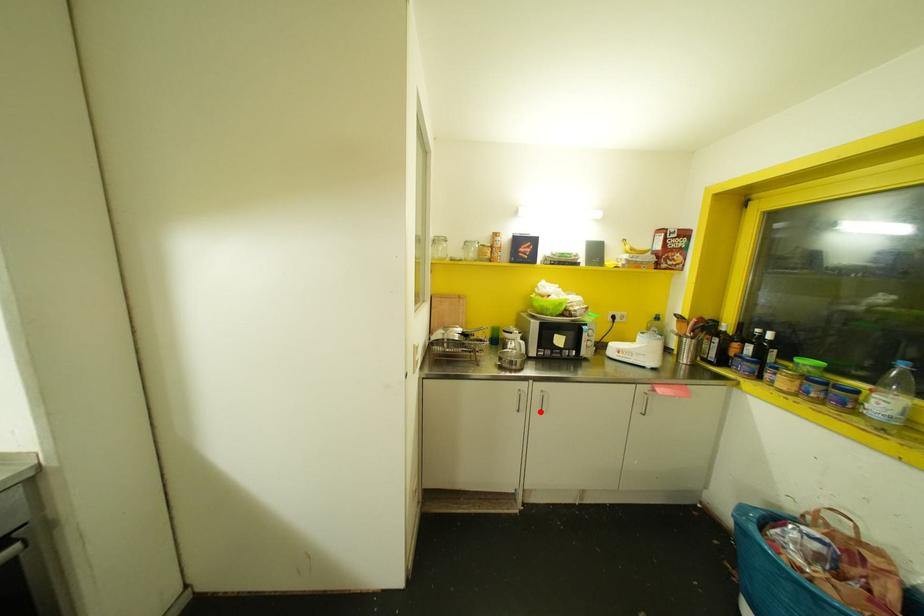
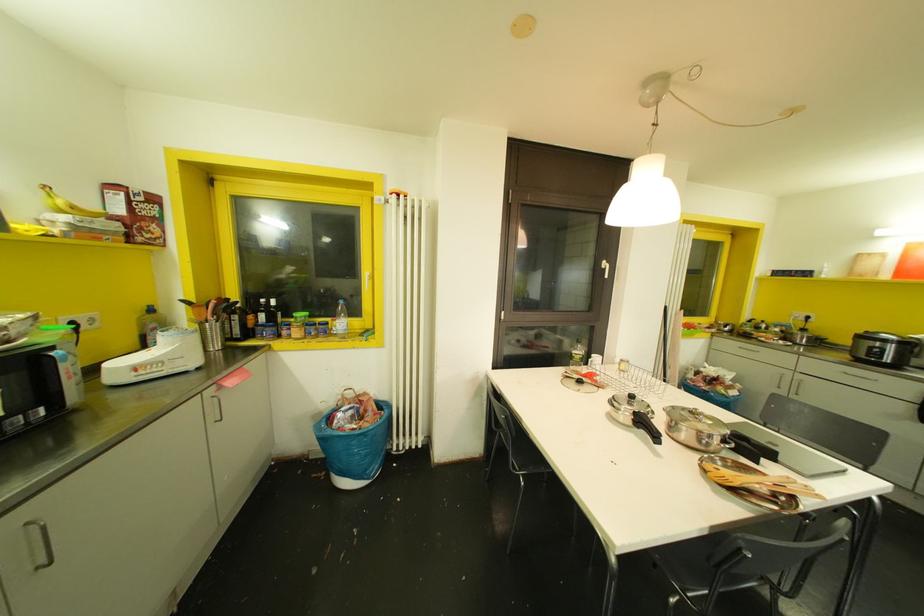
The point at the highlighted location is marked in the first image. Where is the corresponding point in the second image?

(49, 562)